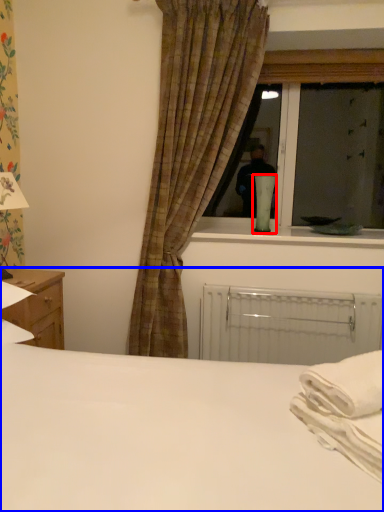
Question: Which of the following is the closest to the observer, table lamp (highlighted by a red box) or bed (highlighted by a blue box)?

Choices:
 (A) table lamp
 (B) bed

Answer: (B)